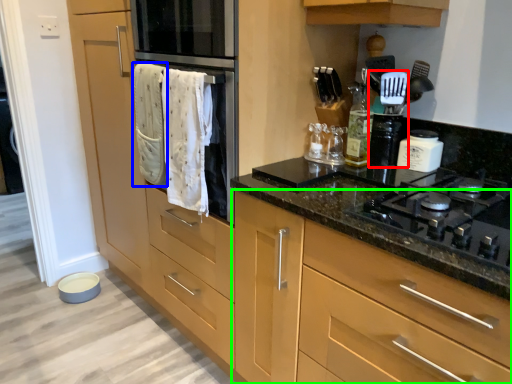
Question: Which is nearer to the appliance (highlighted by a red box)? bath towel (highlighted by a blue box) or cabinetry (highlighted by a green box).

Choices:
 (A) bath towel
 (B) cabinetry

Answer: (B)